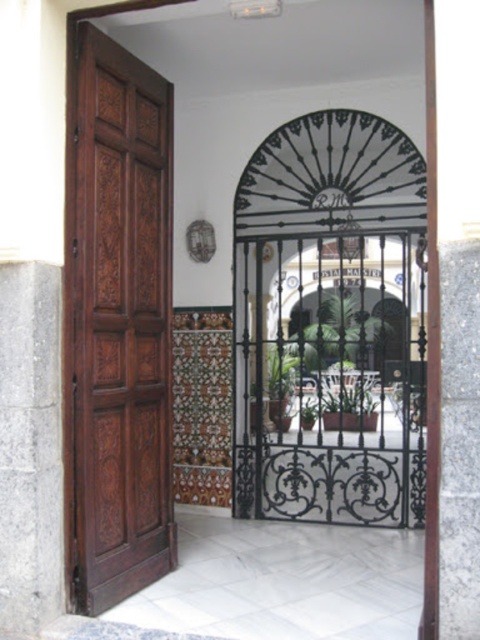
The height and width of the screenshot is (640, 480). Find the location of `brown carved wood door at left`. brown carved wood door at left is located at coordinates (120, 321).

Can you confirm if brown carved wood door at left is thinner than brown wood pillar at right?

Incorrect, brown carved wood door at left's width is not less than brown wood pillar at right's.

You are a GUI agent. You are given a task and a screenshot of the screen. Output one action in this format:
    pyautogui.click(x=<x>, y=<y>)
    Task: Click on the brown carved wood door at left
    This screenshot has width=480, height=640.
    Given the screenshot: What is the action you would take?
    pyautogui.click(x=120, y=321)

Which is behind, point (126, 550) or point (32, 499)?

The point (126, 550) is more distant.

Can you confirm if brown carved wood door at left is positioned above gray stone pillar at left?

Correct, brown carved wood door at left is located above gray stone pillar at left.

Is point (94, 353) farther from viewer compared to point (1, 324)?

Yes, it is behind point (1, 324).

Locate an element on the screen. The height and width of the screenshot is (640, 480). brown carved wood door at left is located at coordinates (120, 321).

Does gray stone pillar at left appear under brown wood pillar at right?

Correct, gray stone pillar at left is located below brown wood pillar at right.

Can you confirm if gray stone pillar at left is positioned to the left of brown wood pillar at right?

Indeed, gray stone pillar at left is positioned on the left side of brown wood pillar at right.

Who is more distant from viewer, (55, 534) or (439, 561)?

Positioned behind is point (55, 534).

You are a GUI agent. You are given a task and a screenshot of the screen. Output one action in this format:
    pyautogui.click(x=<x>, y=<y>)
    Task: Click on the gray stone pillar at left
    
    Given the screenshot: What is the action you would take?
    pyautogui.click(x=31, y=448)